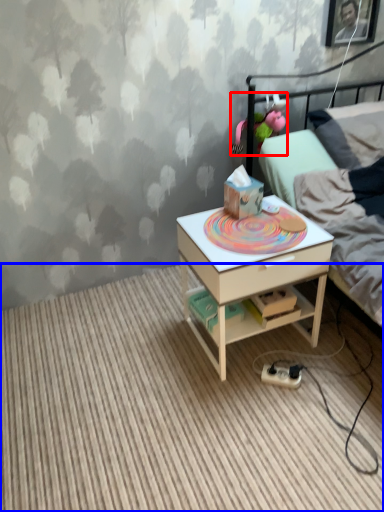
Question: Among these objects, which one is nearest to the camera, toy (highlighted by a red box) or plain (highlighted by a blue box)?

Choices:
 (A) toy
 (B) plain

Answer: (B)